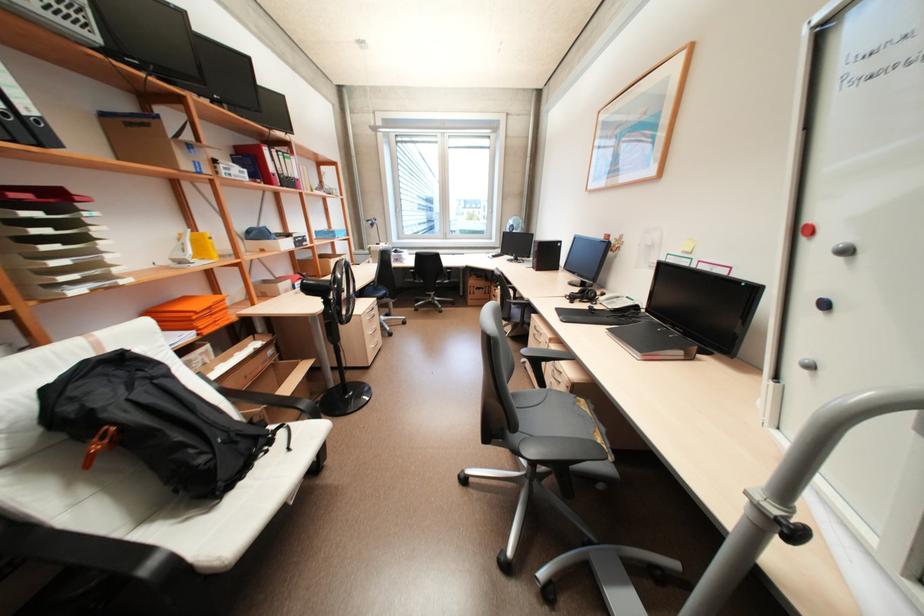
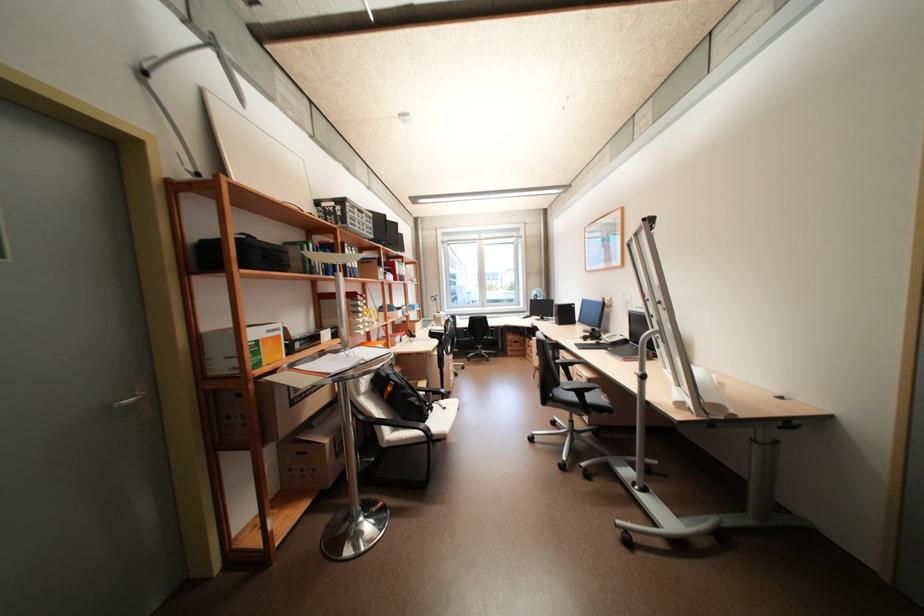
Locate, in the second image, the point that corresponds to the point at 207,460 in the first image.

(423, 403)